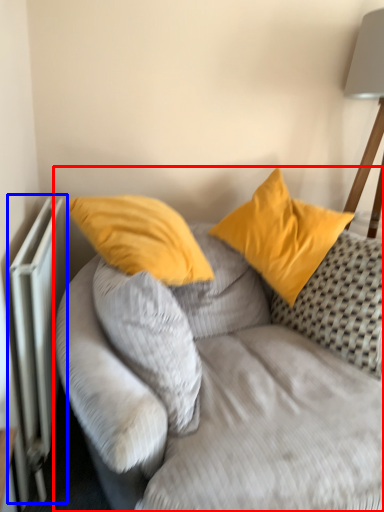
Question: Among these objects, which one is nearest to the camera, studio couch (highlighted by a red box) or radiator (highlighted by a blue box)?

Choices:
 (A) studio couch
 (B) radiator

Answer: (A)